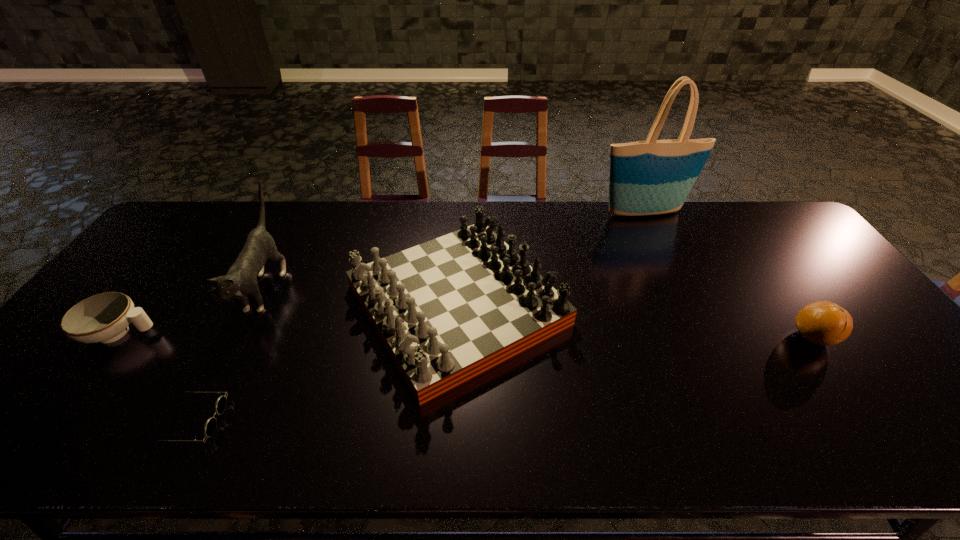
You are a GUI agent. You are given a task and a screenshot of the screen. Output one action in this format:
    pyautogui.click(x=<x>, y=<y>)
    Task: Click on the object that is at the right edge
    The image size is (960, 540).
    Given the screenshot: What is the action you would take?
    pyautogui.click(x=825, y=323)

The width and height of the screenshot is (960, 540). In the image, there is a desktop. What are the coordinates of `vacant space at the far edge` in the screenshot? It's located at (393, 242).

The height and width of the screenshot is (540, 960). Find the location of `vacant space at the near edge`. vacant space at the near edge is located at coordinates (631, 438).

At what (x,y) coordinates should I click in order to perform the action: click on vacant space at the right edge of the desktop. Please return your answer as a coordinate pair (x, y). Looking at the image, I should click on (884, 398).

Locate an element on the screen. Image resolution: width=960 pixels, height=540 pixels. vacant space at the far left corner of the desktop is located at coordinates (171, 220).

In the image, there is a desktop. What are the coordinates of `vacant space at the far right corner` in the screenshot? It's located at (761, 229).

Find the location of a particular element. vacant point located between the third shortest object and the third object from right to left is located at coordinates (635, 321).

Where is `empty space between the tote bag and the fourth tallest object`? The width and height of the screenshot is (960, 540). empty space between the tote bag and the fourth tallest object is located at coordinates (728, 275).

Locate an element on the screen. The image size is (960, 540). vacant area between the sunglasses and the rightmost object is located at coordinates (503, 380).

Find the location of a particular element. free space that is in between the sunglasses and the third object from right to left is located at coordinates point(325,363).